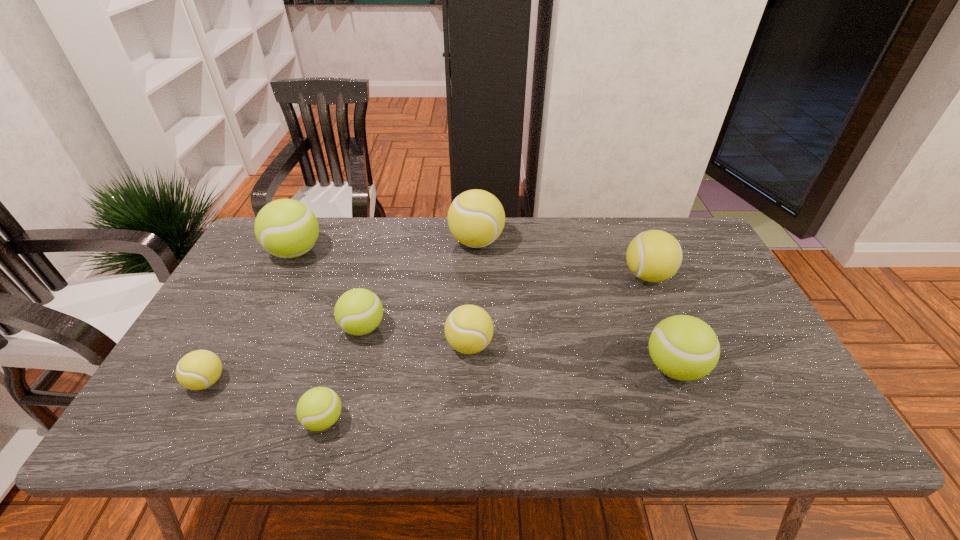
The image size is (960, 540). What are the coordinates of `object that is the sixth closest one to the smallest yellow tennis ball` in the screenshot? It's located at (683, 347).

Choose which object is the sixth nearest neighbor to the biggest yellow tennis ball. Please provide its 2D coordinates. Your answer should be formatted as a tuple, i.e. [(x, y)], where the tuple contains the x and y coordinates of a point satisfying the conditions above.

[(319, 408)]

Identify which tennis ball is located as the second nearest to the farthest green tennis ball. Please provide its 2D coordinates. Your answer should be formatted as a tuple, i.e. [(x, y)], where the tuple contains the x and y coordinates of a point satisfying the conditions above.

[(197, 370)]

This screenshot has width=960, height=540. What are the coordinates of `tennis ball that stands as the fifth closest to the farthest yellow tennis ball` in the screenshot? It's located at (683, 347).

Identify which yellow tennis ball is located as the nearest to the nearest tennis ball. Please provide its 2D coordinates. Your answer should be formatted as a tuple, i.e. [(x, y)], where the tuple contains the x and y coordinates of a point satisfying the conditions above.

[(197, 370)]

The image size is (960, 540). Identify the location of yellow tennis ball object that ranks as the closest to the rightmost green tennis ball. (654, 255).

Identify which green tennis ball is the third nearest to the nearest tennis ball. Please provide its 2D coordinates. Your answer should be formatted as a tuple, i.e. [(x, y)], where the tuple contains the x and y coordinates of a point satisfying the conditions above.

[(683, 347)]

Select which green tennis ball is the second closest to the rightmost green tennis ball. Please provide its 2D coordinates. Your answer should be formatted as a tuple, i.e. [(x, y)], where the tuple contains the x and y coordinates of a point satisfying the conditions above.

[(319, 408)]

Where is `vacant area that satisfies the following two spatial constraints: 1. on the front side of the second smallest green tennis ball; 2. on the left side of the biggest green tennis ball`? vacant area that satisfies the following two spatial constraints: 1. on the front side of the second smallest green tennis ball; 2. on the left side of the biggest green tennis ball is located at coordinates (258, 328).

You are a GUI agent. You are given a task and a screenshot of the screen. Output one action in this format:
    pyautogui.click(x=<x>, y=<y>)
    Task: Click on the free point that satisfies the following two spatial constraints: 1. on the back side of the second nearest yellow tennis ball; 2. on the left side of the nearest tennis ball
    This screenshot has height=540, width=960.
    Given the screenshot: What is the action you would take?
    pyautogui.click(x=346, y=345)